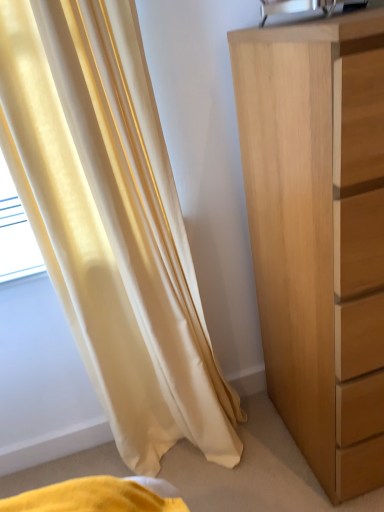
Question: Is satin yellow curtain at left wider or thinner than light brown wood chest of drawers at right?

Choices:
 (A) thin
 (B) wide

Answer: (A)

Question: Relative to light brown wood chest of drawers at right, is satin yellow curtain at left in front or behind?

Choices:
 (A) behind
 (B) front

Answer: (A)

Question: Is point (61, 298) closer or farther from the camera than point (354, 449)?

Choices:
 (A) closer
 (B) farther

Answer: (B)

Question: From their relative heights in the image, would you say light brown wood chest of drawers at right is taller or shorter than satin yellow curtain at left?

Choices:
 (A) short
 (B) tall

Answer: (A)

Question: Considering the relative positions of light brown wood chest of drawers at right and satin yellow curtain at left in the image provided, is light brown wood chest of drawers at right to the left or to the right of satin yellow curtain at left?

Choices:
 (A) right
 (B) left

Answer: (A)

Question: Relative to satin yellow curtain at left, is light brown wood chest of drawers at right in front or behind?

Choices:
 (A) behind
 (B) front

Answer: (B)

Question: Is light brown wood chest of drawers at right inside the boundaries of satin yellow curtain at left, or outside?

Choices:
 (A) outside
 (B) inside

Answer: (A)